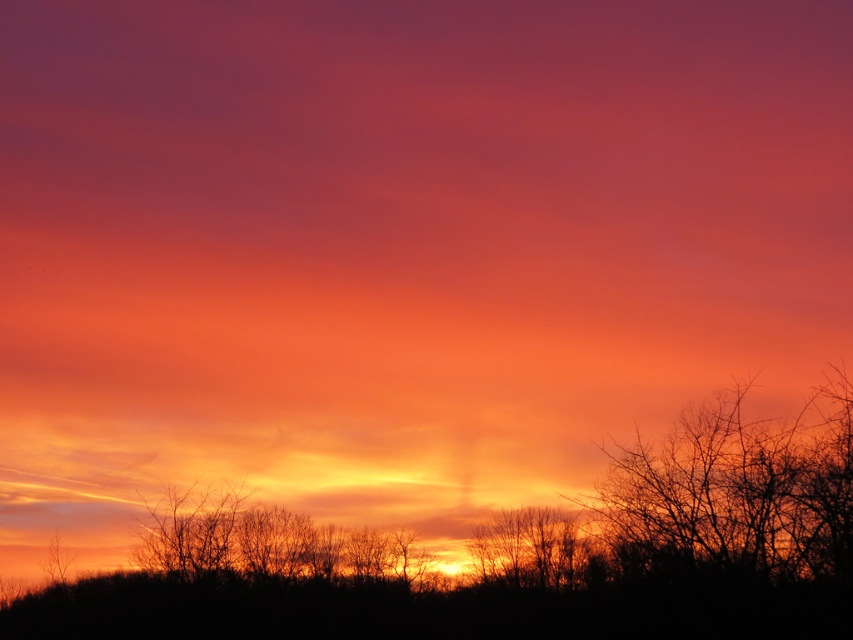
Who is higher up, silhouette bare branches at right or silhouette bare tree at center?

silhouette bare branches at right

Which of these two, silhouette bare branches at right or silhouette bare tree at center, stands shorter?

Standing shorter between the two is silhouette bare branches at right.

This screenshot has width=853, height=640. I want to click on silhouette bare branches at right, so click(x=735, y=492).

Identify the location of silhouette bare branches at right. This screenshot has width=853, height=640. coord(735,492).